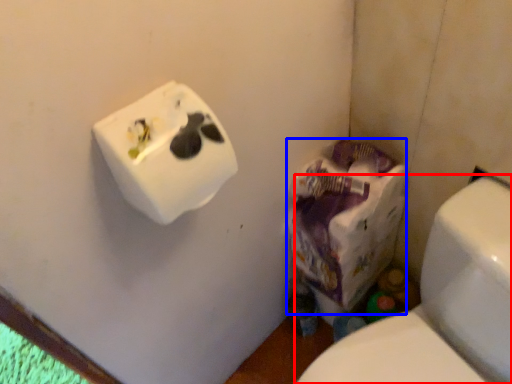
Question: Which object is further to the camera taking this photo, toilet (highlighted by a red box) or paper bag (highlighted by a blue box)?

Choices:
 (A) toilet
 (B) paper bag

Answer: (B)